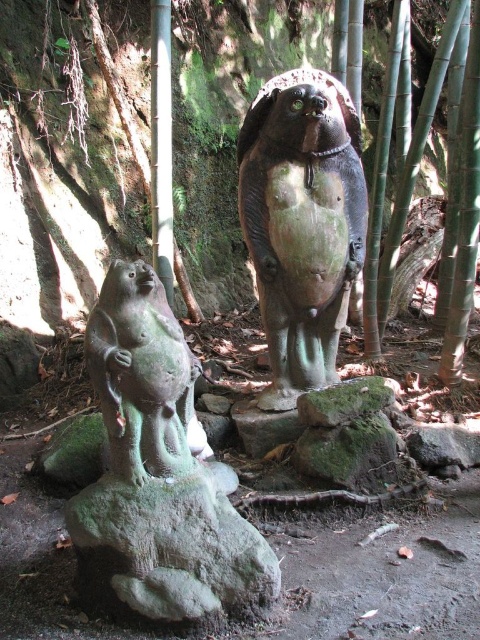
You are standing at the camera position looking at the green stone statue at center. If you take one step forward, will you be closer to the statue than 5 feet?

The green stone statue at center and camera are 6.14 feet apart from each other. If you take one step forward, you would reduce the distance by approximately 1 foot, resulting in a distance of about 5.14 feet. Since this is still more than 5 feet, you will not be closer than 5 feet to the statue.

You are a visitor standing in front of the two statues. You want to take a photo of the green stone statue at center and the green stone monkey at lower left. Which statue should you focus on first to ensure both are in frame?

You should focus on the green stone monkey at lower left first because it is closer to you than the green stone statue at center, which is further away. This way, both will be in frame when you adjust your camera.

You are a park ranger who needs to locate the green stone statue at center. According to the map coordinates provided, where exactly is it positioned?

The green stone statue at center is located at point (x=301, y=221).